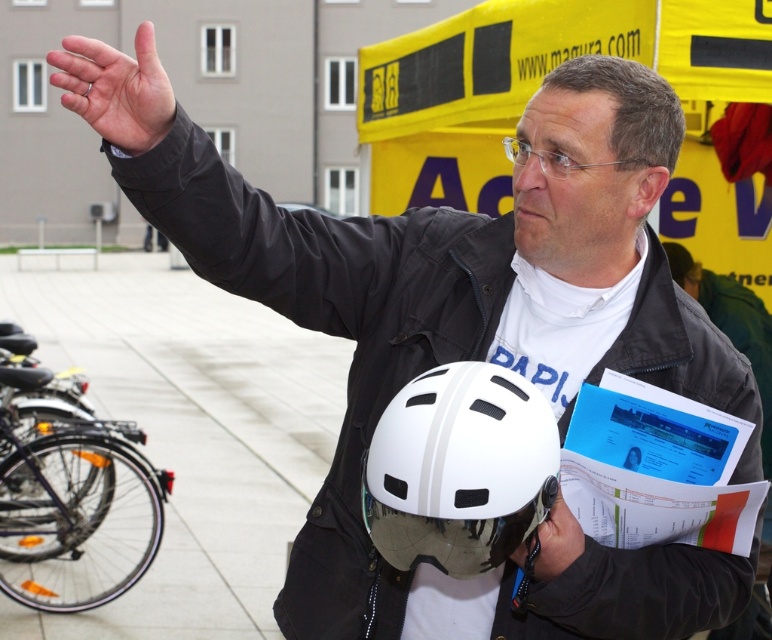
Looking at this image, you are a photographer taking a picture of the scene. You notice a point at coordinates (117, 90). What object is located at that point?

The point at coordinates (117, 90) corresponds to the matte black hand at upper left.

You are a photographer standing at the origin point of the coordinate system. You want to take a photo of the white matte helmet at center located at point [459,468]. What direction should you move to get closer to it?

The white matte helmet at center is located at point [459,468]. Since you are at the origin point, you should move in the positive x and y directions to reach the helmet.